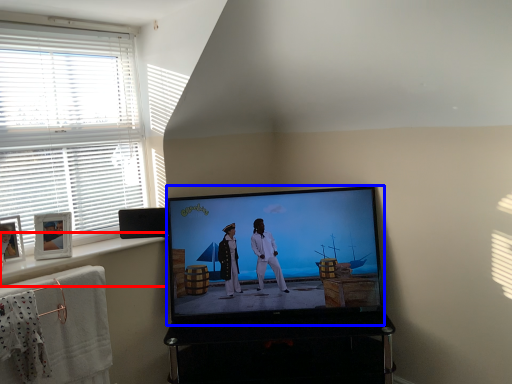
Question: Which of the following is the farthest to the observer, window sill (highlighted by a red box) or television (highlighted by a blue box)?

Choices:
 (A) window sill
 (B) television

Answer: (B)